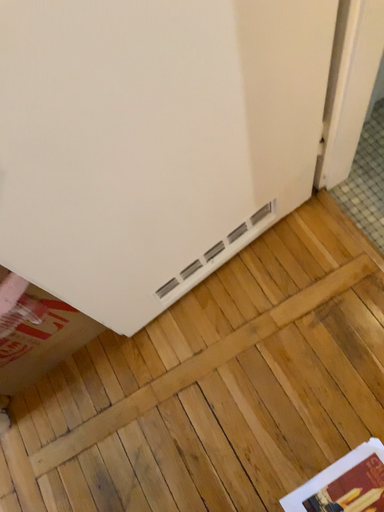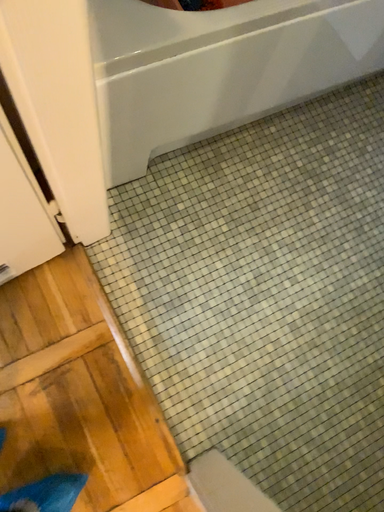
Question: Which way did the camera rotate in the video?

Choices:
 (A) rotated right
 (B) rotated left

Answer: (A)